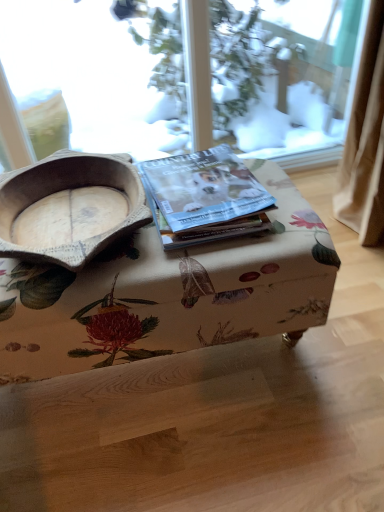
Where is `free space in front of floral fabric ottoman at center`? This screenshot has width=384, height=512. free space in front of floral fabric ottoman at center is located at coordinates (164, 451).